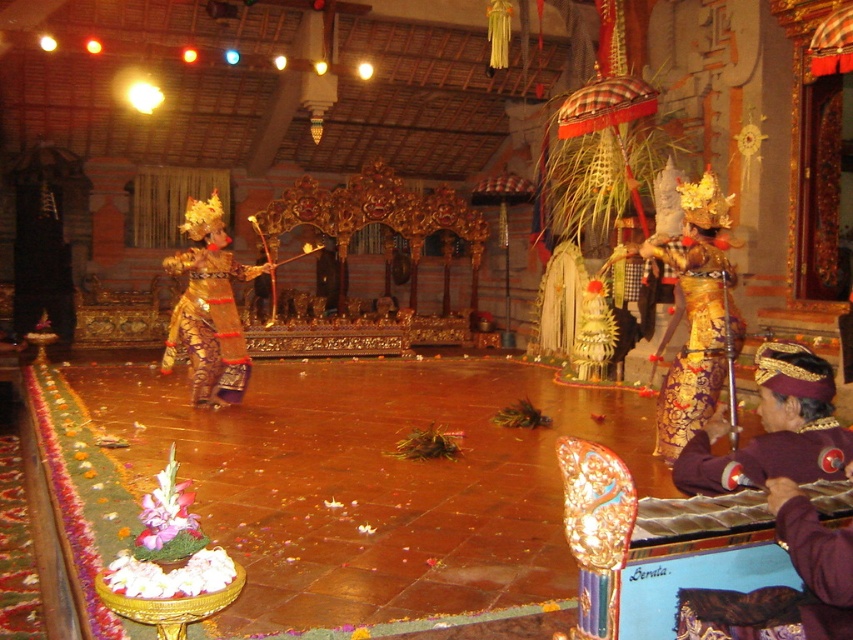
Which is above, purple velvet hat at lower right or gold textured costume at center?

gold textured costume at center is above.

This screenshot has width=853, height=640. Describe the element at coordinates (773, 429) in the screenshot. I see `purple velvet hat at lower right` at that location.

The height and width of the screenshot is (640, 853). Find the location of `purple velvet hat at lower right`. purple velvet hat at lower right is located at coordinates (773, 429).

This screenshot has height=640, width=853. In order to click on purple velvet hat at lower right in this screenshot , I will do `click(773, 429)`.

Which is above, gold textured costume at center or gold brocade costume at center?

gold textured costume at center

Is gold textured costume at center closer to the viewer compared to gold brocade costume at center?

No.

Which is behind, point (227, 342) or point (717, 262)?

The point (227, 342) is behind.

This screenshot has height=640, width=853. What are the coordinates of `gold textured costume at center` in the screenshot? It's located at (209, 308).

Does purple velvet hat at lower right appear under purple velvet gloves at lower right?

Actually, purple velvet hat at lower right is above purple velvet gloves at lower right.

Does purple velvet hat at lower right come behind purple velvet gloves at lower right?

Yes, purple velvet hat at lower right is further from the viewer.

Locate an element on the screen. purple velvet hat at lower right is located at coordinates (773, 429).